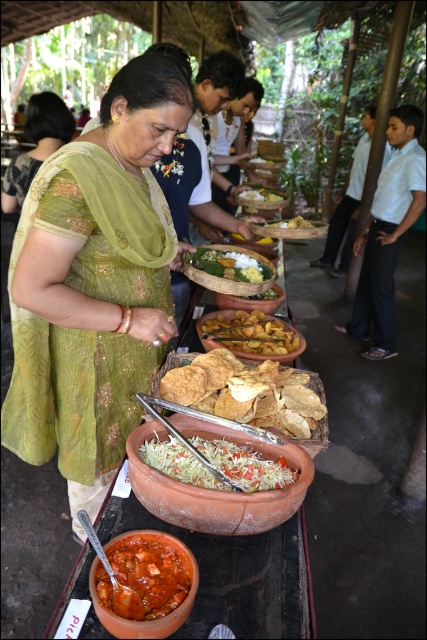
Can you confirm if golden crispy chips at center is thinner than white shredded food at center?

No.

Is point (184, 362) positioned before point (259, 458)?

That is False.

I want to click on golden crispy chips at center, so click(x=248, y=392).

Can you confirm if golden crispy chips at center is positioned to the left of green fabric saree at center?

In fact, golden crispy chips at center is to the right of green fabric saree at center.

Image resolution: width=427 pixels, height=640 pixels. What do you see at coordinates (248, 392) in the screenshot?
I see `golden crispy chips at center` at bounding box center [248, 392].

Identify the location of golden crispy chips at center. Image resolution: width=427 pixels, height=640 pixels. (248, 392).

Does tomato-based curry at center have a greater width compared to smooth brown rice at center?

No, tomato-based curry at center is not wider than smooth brown rice at center.

Image resolution: width=427 pixels, height=640 pixels. I want to click on tomato-based curry at center, so point(143,577).

Find the location of a particular element. tomato-based curry at center is located at coordinates (143, 577).